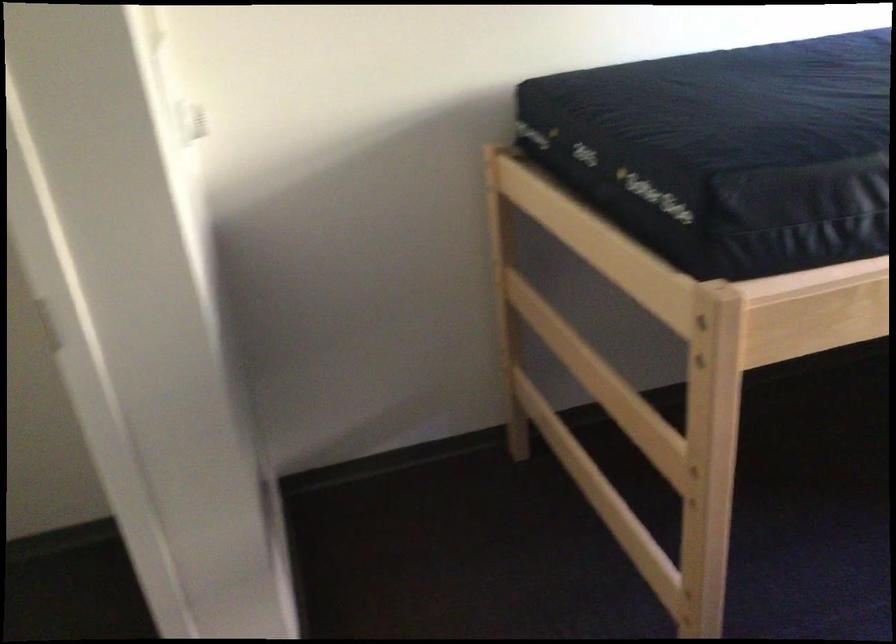
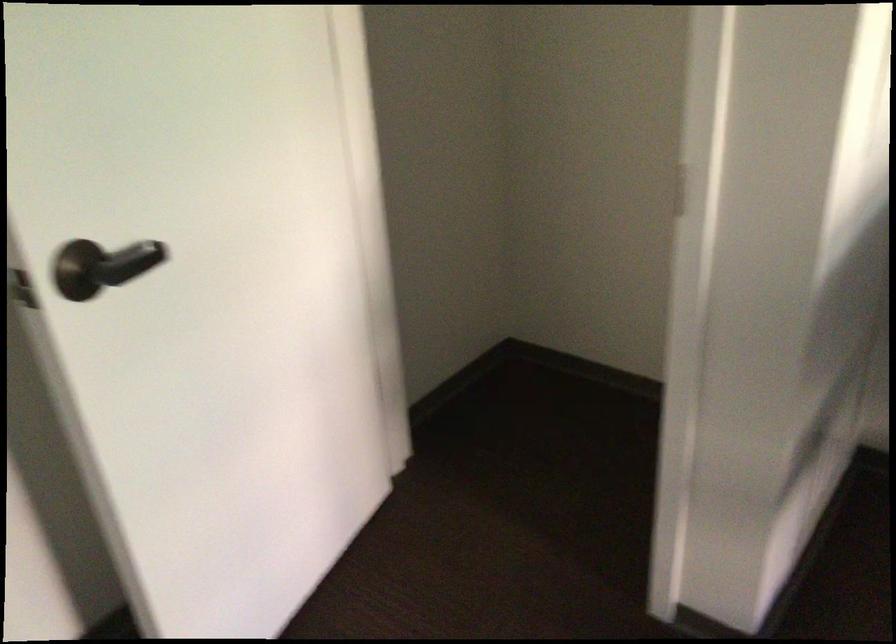
The first image is from the beginning of the video and the second image is from the end. How did the camera likely rotate when shooting the video?

The camera's rotation is toward left-down.